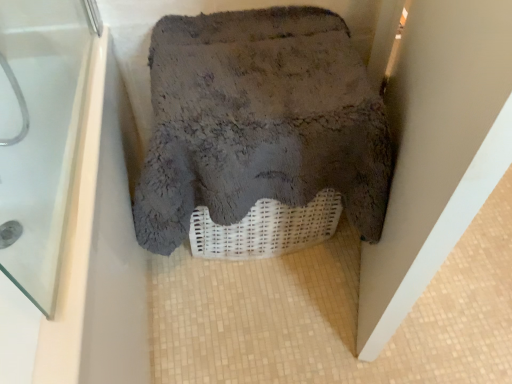
The height and width of the screenshot is (384, 512). Describe the element at coordinates (259, 121) in the screenshot. I see `gray fluffy towel at center` at that location.

Locate an element on the screen. The width and height of the screenshot is (512, 384). gray fluffy towel at center is located at coordinates (259, 121).

What is the approximate width of gray fluffy towel at center?

gray fluffy towel at center is 20.77 inches wide.

Measure the distance between point (213,74) and camera.

They are 37.68 inches apart.

Image resolution: width=512 pixels, height=384 pixels. Find the location of `gray fluffy towel at center`. gray fluffy towel at center is located at coordinates (259, 121).